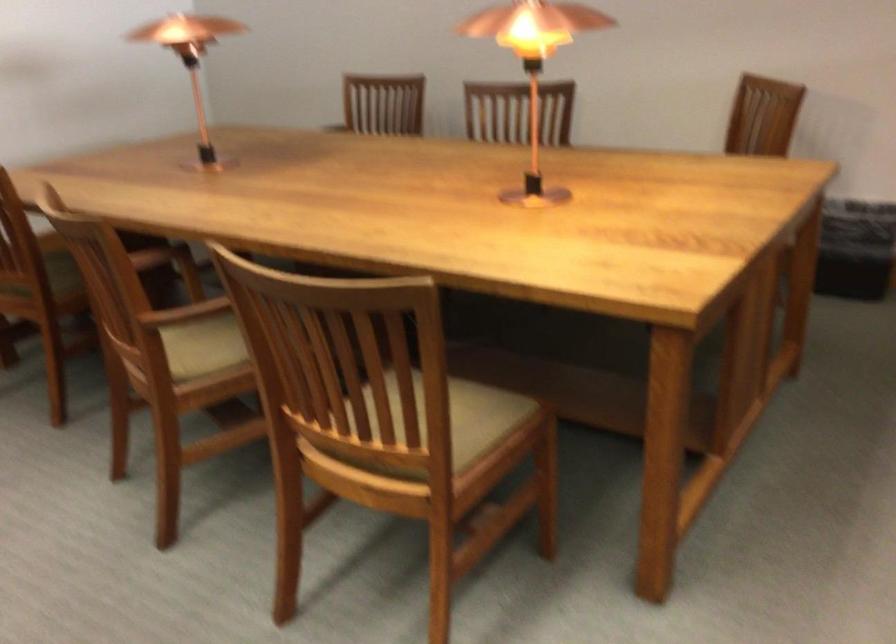
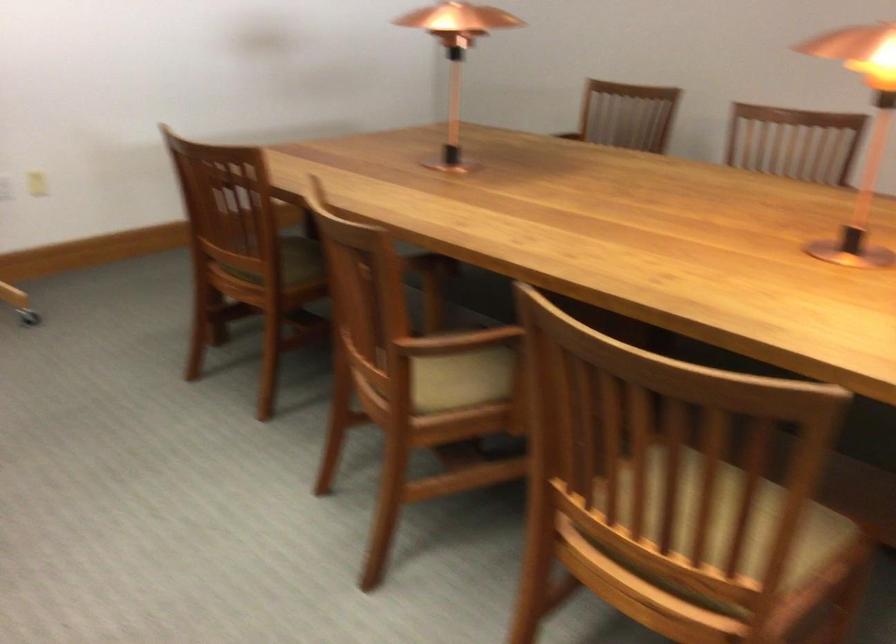
Where in the second image is the point corresponding to point 216,348 from the first image?

(460, 377)